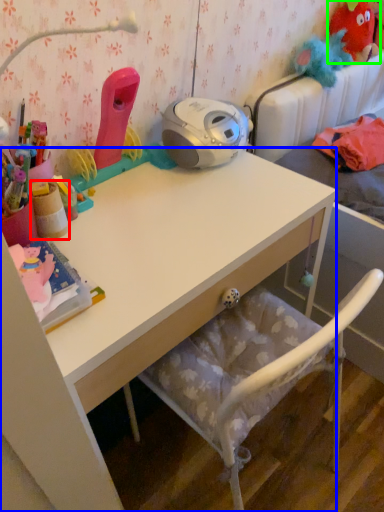
Question: Estimate the real-world distances between objects in this image. Which object is farther from stationery (highlighted by a red box), desk (highlighted by a blue box) or toy (highlighted by a green box)?

Choices:
 (A) desk
 (B) toy

Answer: (B)